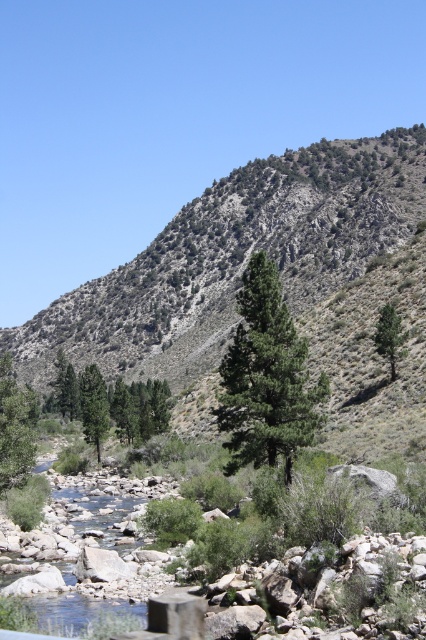
You are a hiker trying to navigate through the rocky riverbed. You notice the green shrubbery at center and the green matte tree at center. Which of these two plants has a wider spread in terms of width?

The green shrubbery at center has a larger width compared to the green matte tree at center, so it has a wider spread.